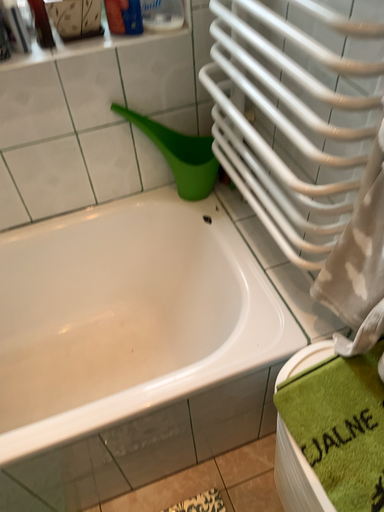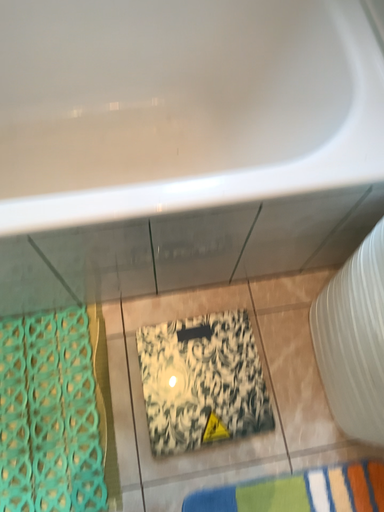
Question: How did the camera likely rotate when shooting the video?

Choices:
 (A) rotated upward
 (B) rotated downward

Answer: (B)